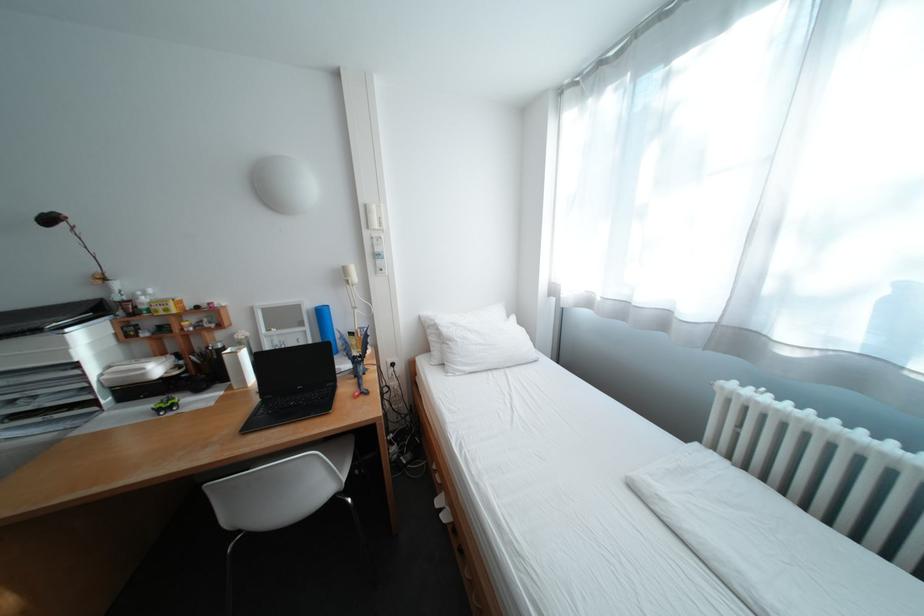
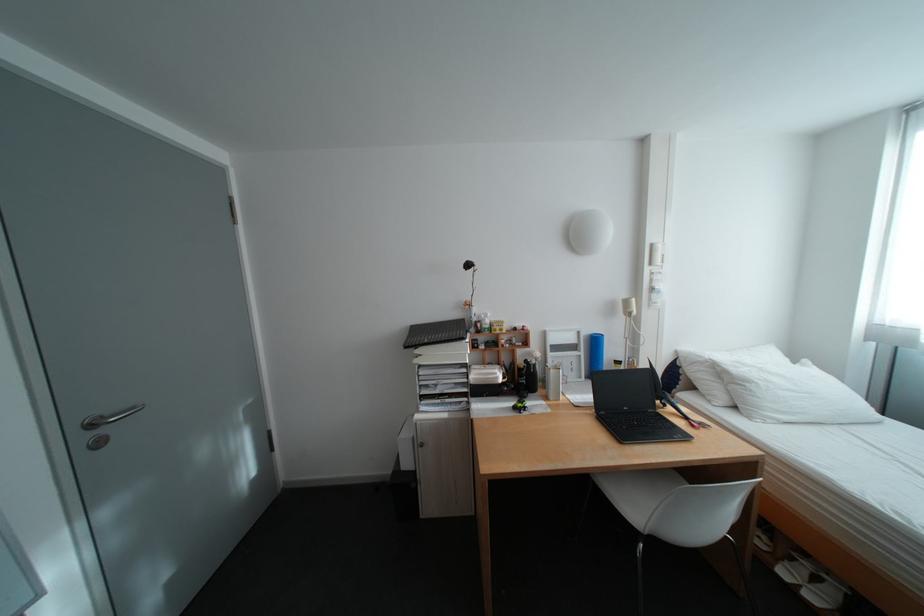
Find the pixel in the second image that matches the point at 320,329 in the first image.

(594, 354)